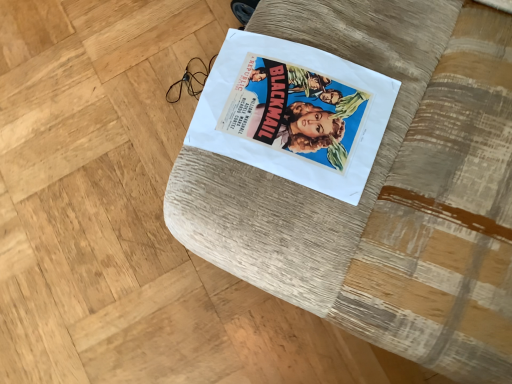
Identify the location of vacant space situated above white paper at center (from a real-world perspective). (287, 112).